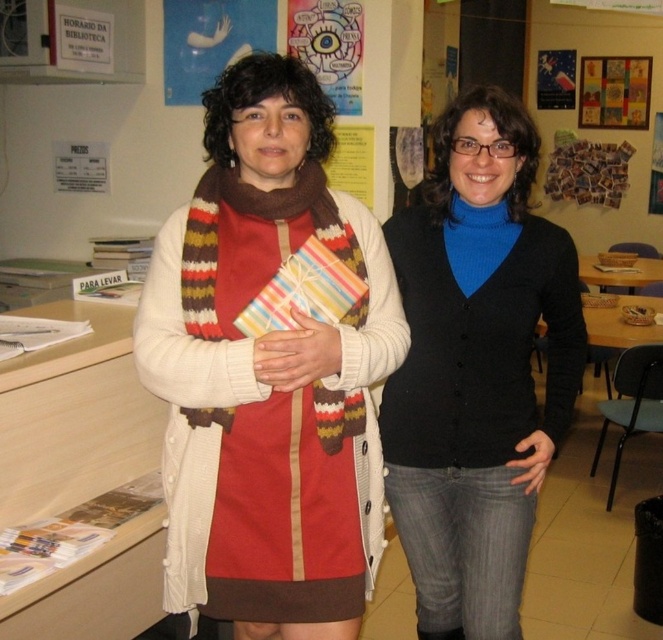
Where is `knitted wool scarf at center`? Image resolution: width=663 pixels, height=640 pixels. knitted wool scarf at center is located at coordinates (477, 241).

Which is more to the left, knitted wool scarf at center or white paper at upper left?

white paper at upper left is more to the left.

Which is in front, point (483, 205) or point (88, 12)?

Point (483, 205)

The width and height of the screenshot is (663, 640). In order to click on knitted wool scarf at center in this screenshot , I will do `click(477, 241)`.

Can you confirm if brown striped scarf at center is positioned to the right of colorful paper poster at upper center?

No, brown striped scarf at center is not to the right of colorful paper poster at upper center.

At what (x,y) coordinates should I click in order to perform the action: click on brown striped scarf at center. Please return your answer as a coordinate pair (x, y). The width and height of the screenshot is (663, 640). Looking at the image, I should click on (253, 218).

At what (x,y) coordinates should I click in order to perform the action: click on brown striped scarf at center. Please return your answer as a coordinate pair (x, y). This screenshot has height=640, width=663. Looking at the image, I should click on (253, 218).

Can you confirm if black matte cardigan at center is shorter than brown striped scarf at center?

No, black matte cardigan at center is not shorter than brown striped scarf at center.

Locate an element on the screen. Image resolution: width=663 pixels, height=640 pixels. black matte cardigan at center is located at coordinates (475, 369).

You are a GUI agent. You are given a task and a screenshot of the screen. Output one action in this format:
    pyautogui.click(x=<x>, y=<y>)
    Task: Click on the black matte cardigan at center
    Image resolution: width=663 pixels, height=640 pixels.
    Given the screenshot: What is the action you would take?
    pyautogui.click(x=475, y=369)